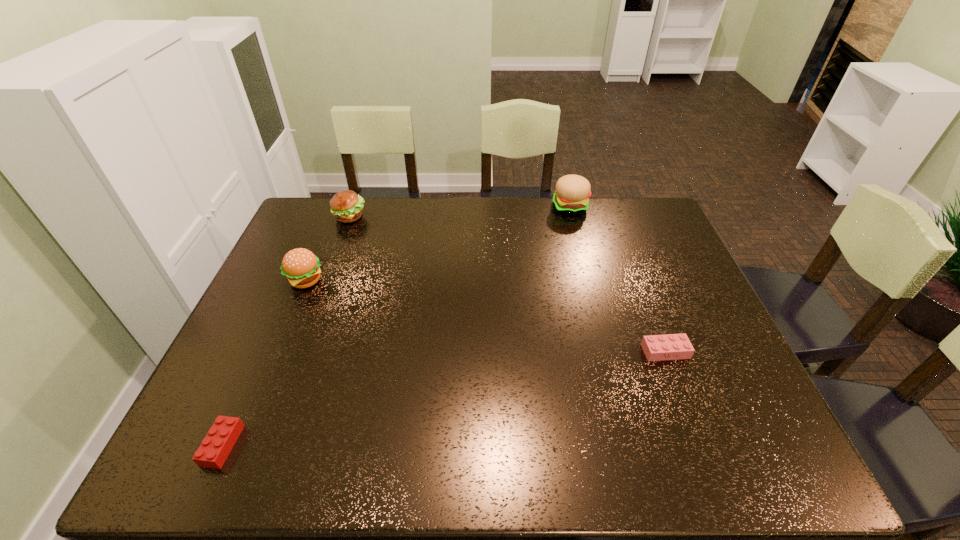
The width and height of the screenshot is (960, 540). What are the coordinates of `the fourth object from left to right` in the screenshot? It's located at (572, 194).

Where is `the nearest hamburger`? This screenshot has height=540, width=960. the nearest hamburger is located at coordinates (300, 266).

I want to click on the right Lego, so click(671, 346).

Find the location of `the rightmost object`. the rightmost object is located at coordinates (671, 346).

Image resolution: width=960 pixels, height=540 pixels. In order to click on the nearer Lego in this screenshot , I will do `click(212, 453)`.

Where is `the nearest object`? the nearest object is located at coordinates (x=212, y=453).

This screenshot has width=960, height=540. I want to click on vacant space located on the front of the fourth object from left to right, so click(591, 289).

Find the location of a particular element. free space located 0.360m on the right of the nearest hamburger is located at coordinates (448, 281).

Find the location of a particular element. free spot located on the front of the right Lego is located at coordinates (701, 444).

This screenshot has height=540, width=960. What are the coordinates of `free space located on the back of the nearer Lego` in the screenshot? It's located at (252, 380).